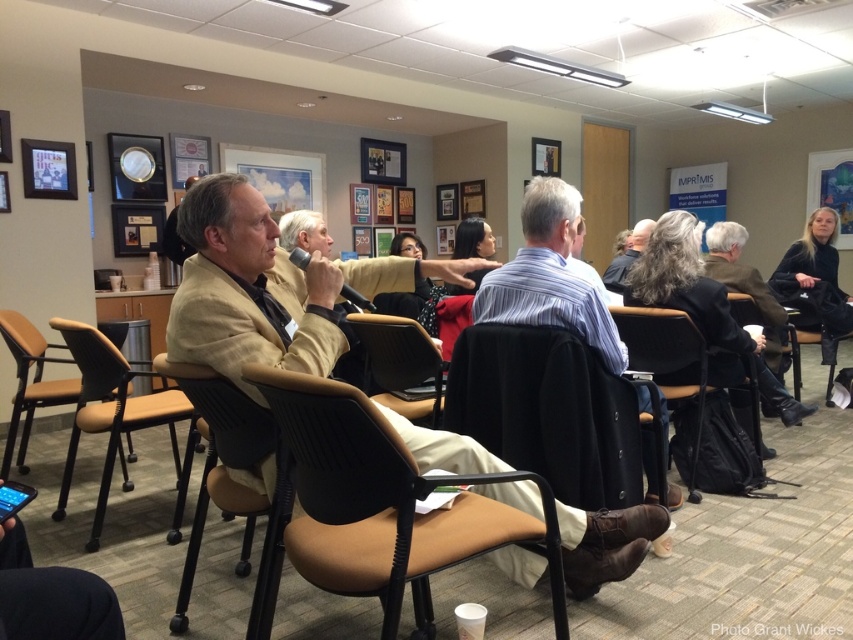
You are organizing a meeting in this conference room and need to seat two people. You have a black plastic chair at center and a brown leather chair at left. Which chair can accommodate a wider person?

The black plastic chair at center has a greater width than the brown leather chair at left, so it can accommodate a wider person.